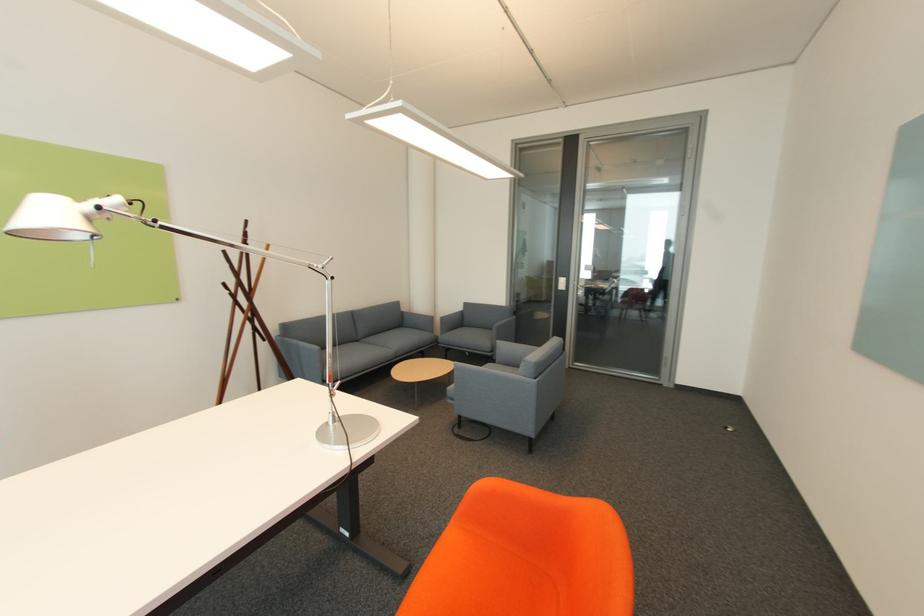
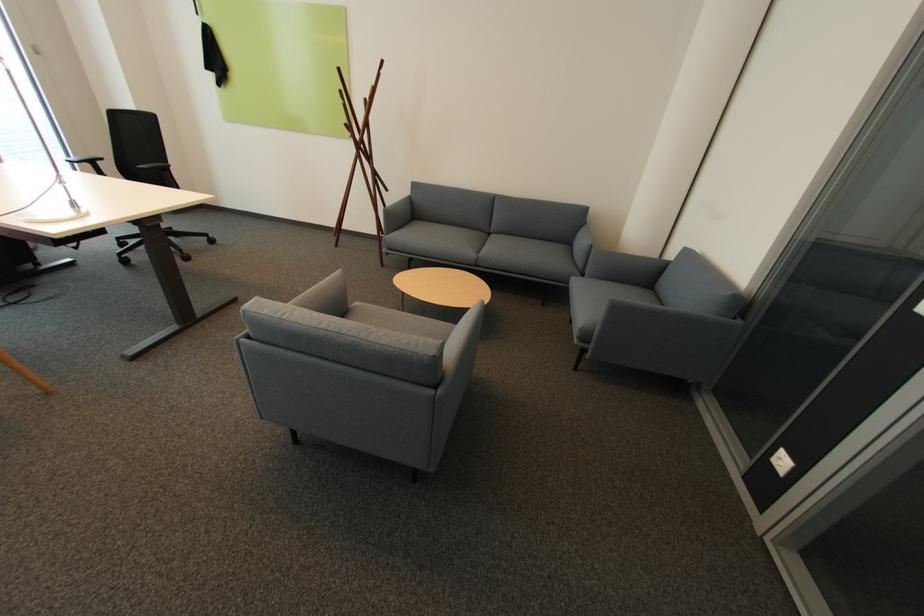
Locate, in the second image, the point that corresponds to the point at 402,358 in the first image.

(482, 265)